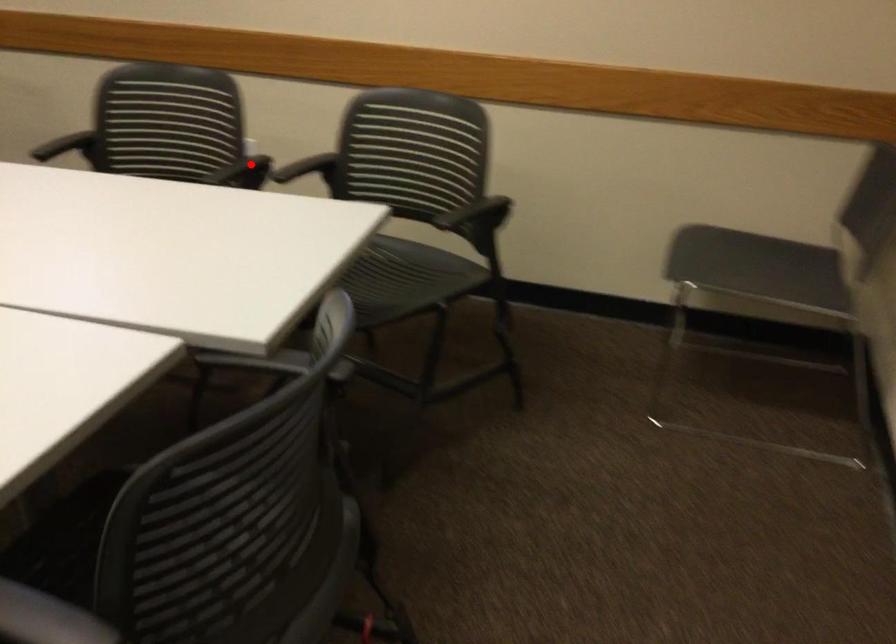
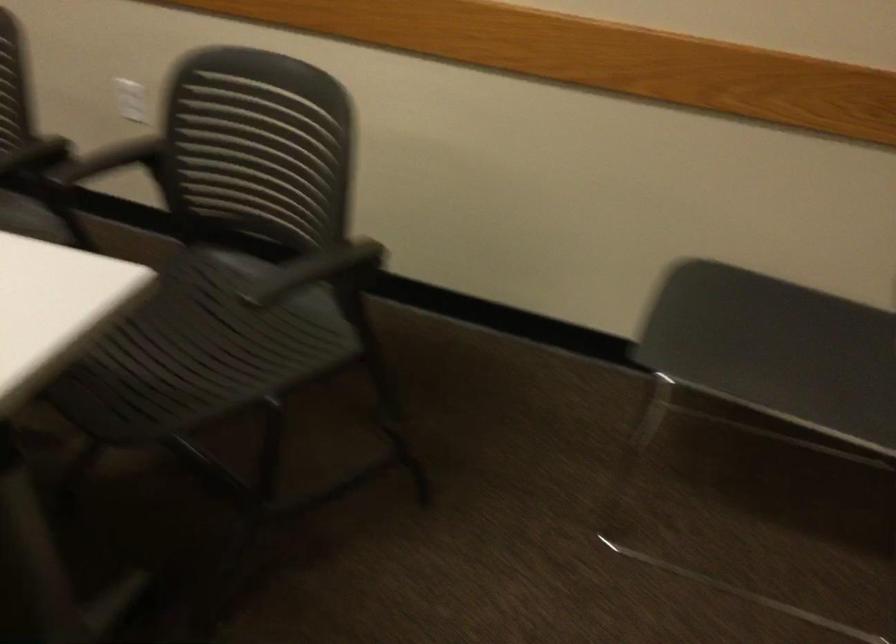
Question: I am providing you with two images of the same scene from different viewpoints. Image1 has a red point marked. In image2, the corresponding 3D location appears at what relative position? Reply with the corresponding letter.

Choices:
 (A) Closer
 (B) Farther

Answer: (A)